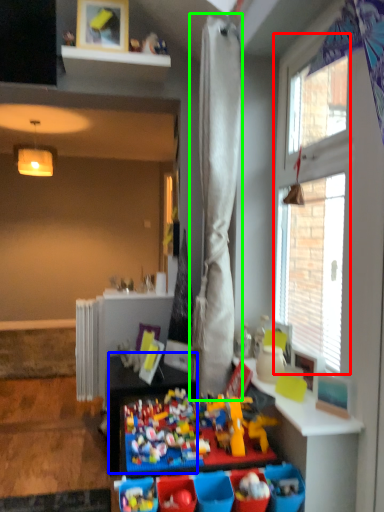
Question: Which object is the farthest from window (highlighted by a red box)? Choose among these: table (highlighted by a blue box) or curtain (highlighted by a green box).

Choices:
 (A) table
 (B) curtain

Answer: (A)